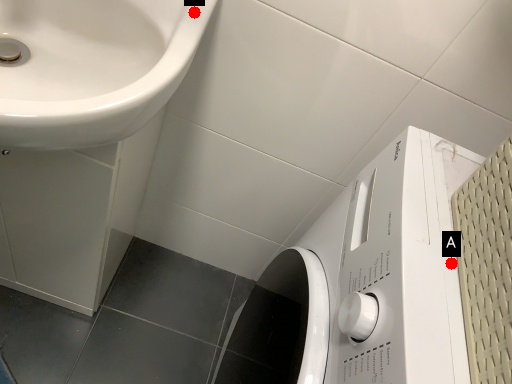
Question: Two points are circled on the image, labeled by A and B beside each circle. Which point appears closest to the camera in this image?

Choices:
 (A) A is closer
 (B) B is closer

Answer: (A)